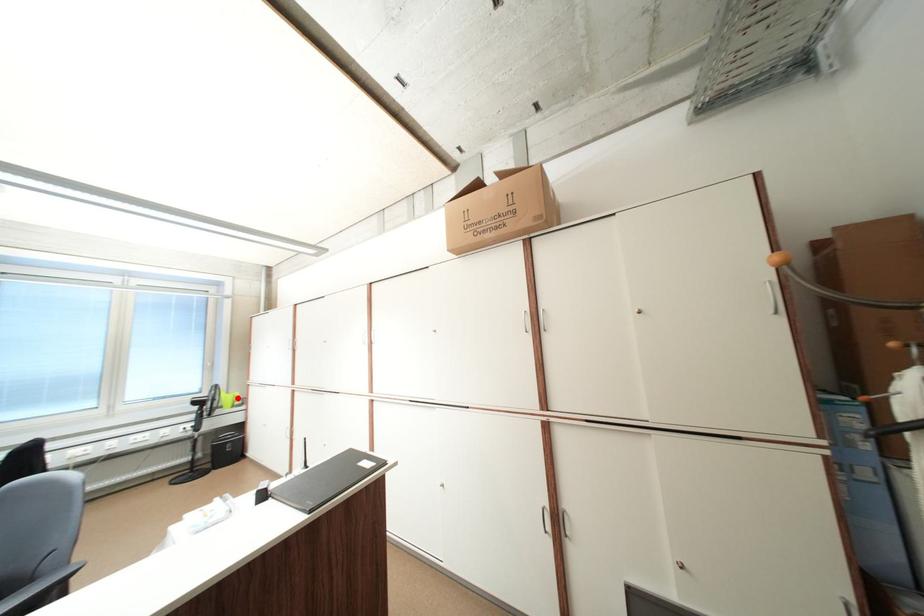
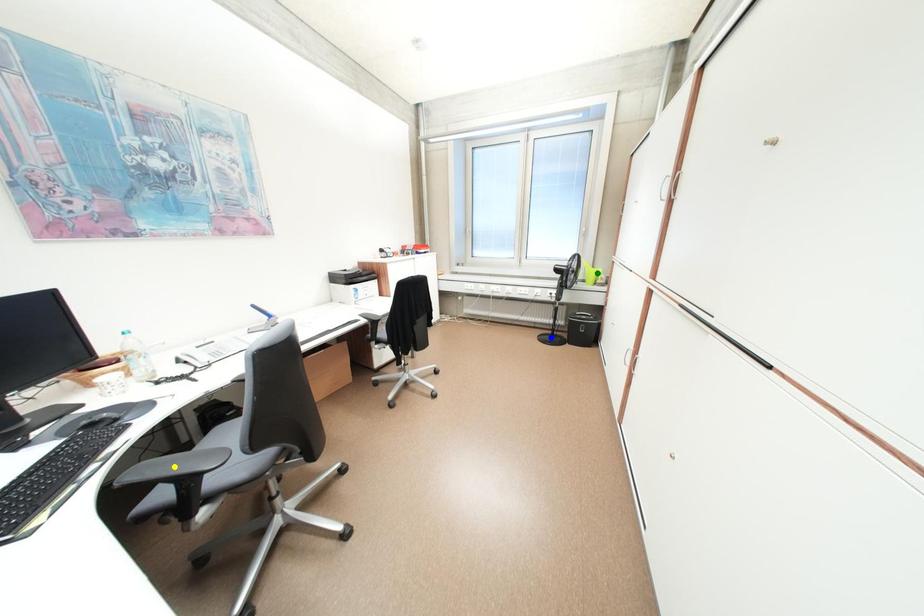
Question: I am providing you with two images of the same scene from different viewpoints. A red point is marked on the first image. You are given multiple points on the second image. Which mark in image 2 goes with the point in image 1?

Choices:
 (A) blue point
 (B) green point
 (C) yellow point

Answer: (B)